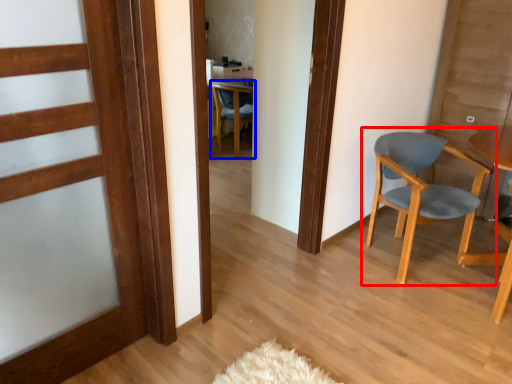
Question: Among these objects, which one is nearest to the camera, chair (highlighted by a red box) or chair (highlighted by a blue box)?

Choices:
 (A) chair
 (B) chair

Answer: (A)